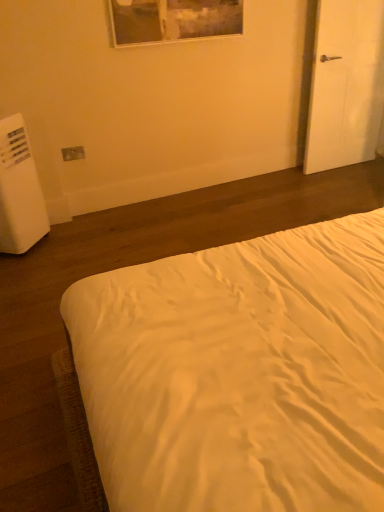
Find the location of a particular element. The image size is (384, 512). free point in front of white plastic water heater at left is located at coordinates (34, 265).